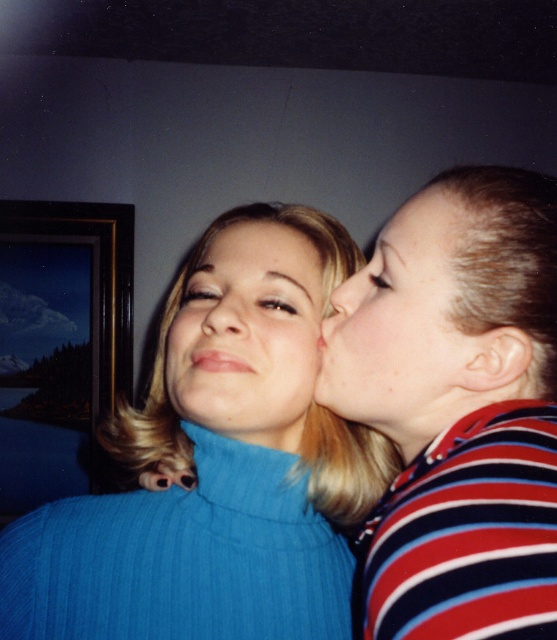
You are an artist analyzing the composition of this scene. You notice the blue ribbed turtleneck at center and the smooth blonde hair at upper center. Which object is positioned to the right side of the other?

The smooth blonde hair at upper center is positioned to the right of the blue ribbed turtleneck at center.

You are standing in the room and want to place a small decorative item between the two points, point (334, 448) and point (285, 253). Considering their positions, which point should the item be closer to in order to be visible from the front of the room?

The item should be closer to point (285, 253) because point (334, 448) is behind point (285, 253), so placing it closer to the front point would ensure visibility from the front of the room.

You are a photographer trying to capture a closeup of the matte skin face at upper right and the matte skin nose at center in the scene described. Given that your camera has a focus range that can only handle objects within 3 inches of each other, will you be able to capture both subjects in sharp focus?

The matte skin face at upper right and the matte skin nose at center are 3.38 inches apart, which exceeds the camera focus range of 3 inches. Therefore, you won